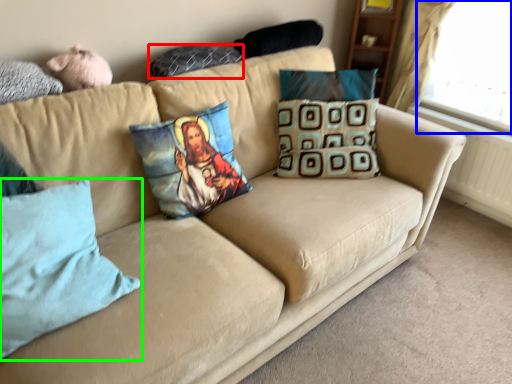
Question: Estimate the real-world distances between objects in this image. Which object is farther from pillow (highlighted by a red box), window screen (highlighted by a blue box) or pillow (highlighted by a green box)?

Choices:
 (A) window screen
 (B) pillow

Answer: (A)